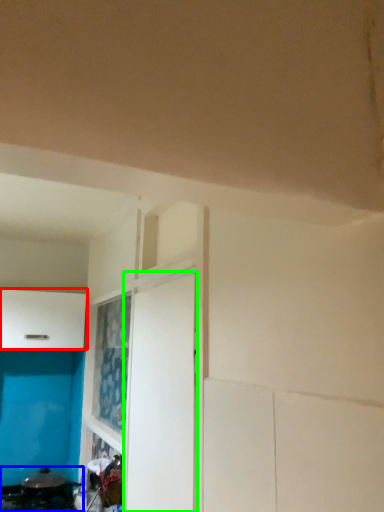
Question: Based on their relative distances, which object is farther from cabinetry (highlighted by a red box)? Choose from appliance (highlighted by a blue box) and door (highlighted by a green box).

Choices:
 (A) appliance
 (B) door

Answer: (B)